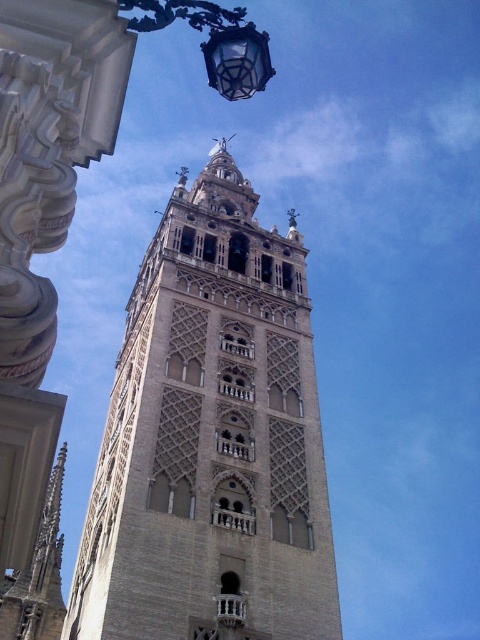
Question: Considering the relative positions of beige stone bell tower at center and clear glass lantern at upper center in the image provided, where is beige stone bell tower at center located with respect to clear glass lantern at upper center?

Choices:
 (A) left
 (B) right

Answer: (B)

Question: Can you confirm if beige stone bell tower at center is positioned to the left of clear glass lantern at upper center?

Choices:
 (A) yes
 (B) no

Answer: (B)

Question: Observing the image, what is the correct spatial positioning of beige stone bell tower at center in reference to clear glass lantern at upper center?

Choices:
 (A) below
 (B) above

Answer: (A)